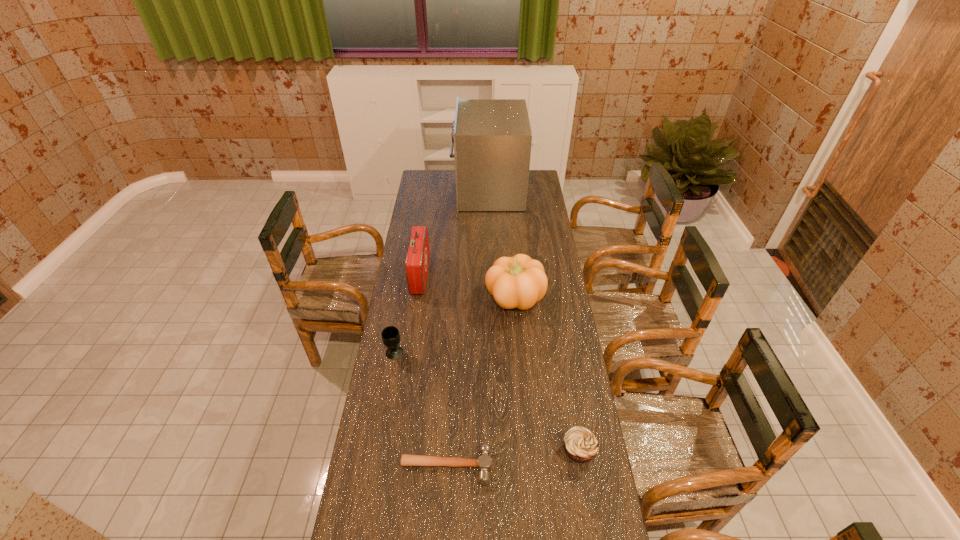
The height and width of the screenshot is (540, 960). In order to click on toaster oven present at the right edge in this screenshot , I will do `click(492, 138)`.

What are the coordinates of `pumpkin that is at the right edge` in the screenshot? It's located at (519, 282).

The width and height of the screenshot is (960, 540). I want to click on muffin at the right edge, so (x=581, y=444).

You are a GUI agent. You are given a task and a screenshot of the screen. Output one action in this format:
    pyautogui.click(x=<x>, y=<y>)
    Task: Click on the object situated at the far right corner
    This screenshot has width=960, height=540.
    Given the screenshot: What is the action you would take?
    pyautogui.click(x=492, y=138)

This screenshot has width=960, height=540. Find the location of `free location at the left edge`. free location at the left edge is located at coordinates (400, 406).

This screenshot has height=540, width=960. In the image, there is a desktop. Identify the location of vacant space at the right edge. (564, 320).

You are a GUI agent. You are given a task and a screenshot of the screen. Output one action in this format:
    pyautogui.click(x=<x>, y=<y>)
    Task: Click on the vacant space at the far right corner of the desktop
    This screenshot has height=540, width=960.
    Given the screenshot: What is the action you would take?
    pyautogui.click(x=543, y=187)

You are a GUI agent. You are given a task and a screenshot of the screen. Output one action in this format:
    pyautogui.click(x=<x>, y=<y>)
    Task: Click on the vacant area between the chalice and the muffin
    This screenshot has width=960, height=540.
    Given the screenshot: What is the action you would take?
    pyautogui.click(x=487, y=402)

Find the location of a particular element. blank region between the first-aid kit and the fourth tallest object is located at coordinates (407, 314).

Locate an element on the screen. The width and height of the screenshot is (960, 540). free space between the pumpkin and the tallest object is located at coordinates (502, 244).